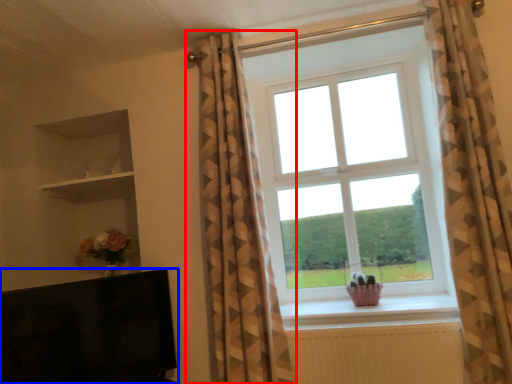
Question: Which object appears farthest to the camera in this image, curtain (highlighted by a red box) or furniture (highlighted by a blue box)?

Choices:
 (A) curtain
 (B) furniture

Answer: (A)